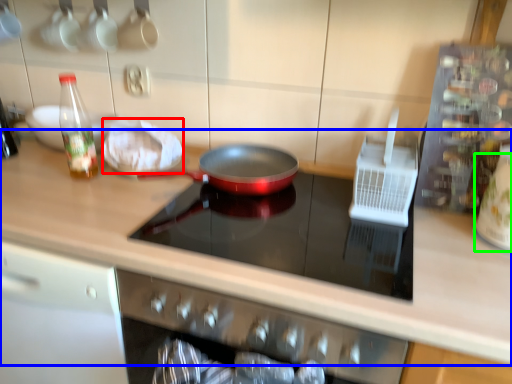
Question: Which object is the farthest from food (highlighted by a red box)? Choose among these: countertop (highlighted by a blue box) or appliance (highlighted by a green box).

Choices:
 (A) countertop
 (B) appliance

Answer: (B)